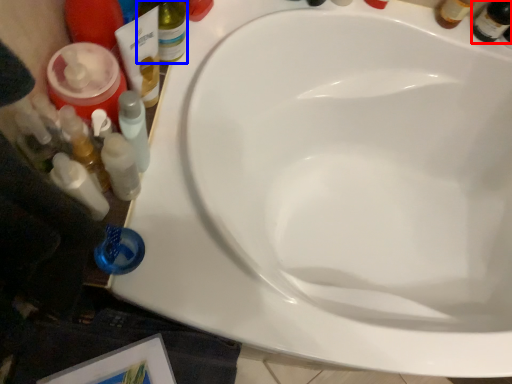
Question: Which of the following is the farthest to the observer, beer bottle (highlighted by a red box) or bottle (highlighted by a blue box)?

Choices:
 (A) beer bottle
 (B) bottle

Answer: (A)